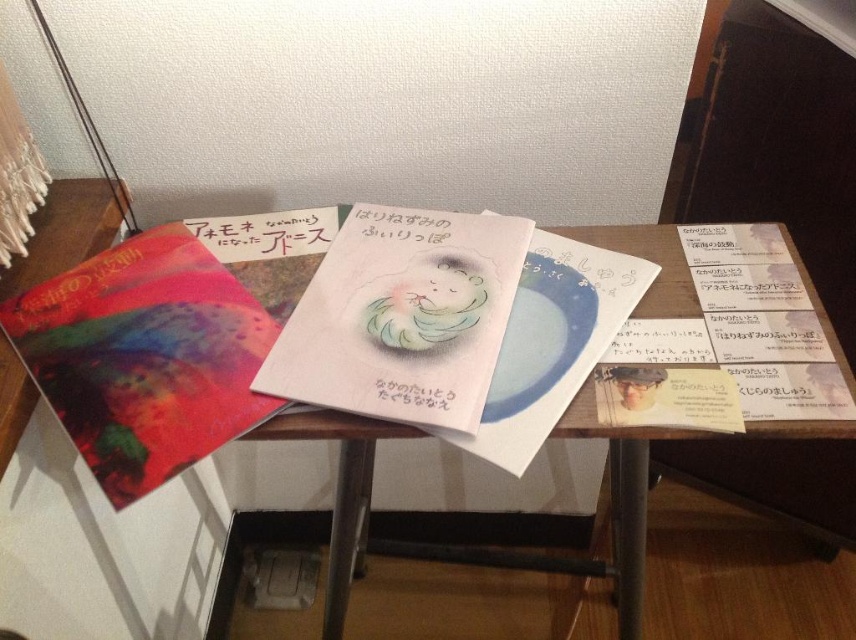
Question: Is pastel watercolor cat at center to the left of white paper at center from the viewer's perspective?

Choices:
 (A) no
 (B) yes

Answer: (A)

Question: Which of the following is the farthest from the observer?

Choices:
 (A) [x=33, y=266]
 (B) [x=116, y=465]
 (C) [x=393, y=275]
 (D) [x=397, y=410]

Answer: (A)

Question: Among these points, which one is farthest from the camera?

Choices:
 (A) (438, 230)
 (B) (214, 280)
 (C) (411, 278)

Answer: (A)

Question: In this image, where is pastel watercolor cat at center located relative to white paper at center?

Choices:
 (A) below
 (B) above

Answer: (A)

Question: Does pastel watercolor cat at center appear on the right side of black paper at center?

Choices:
 (A) yes
 (B) no

Answer: (A)

Question: Which point appears farthest from the camera in this image?

Choices:
 (A) (450, 269)
 (B) (138, 353)
 (C) (382, 381)
 (D) (364, 429)

Answer: (A)